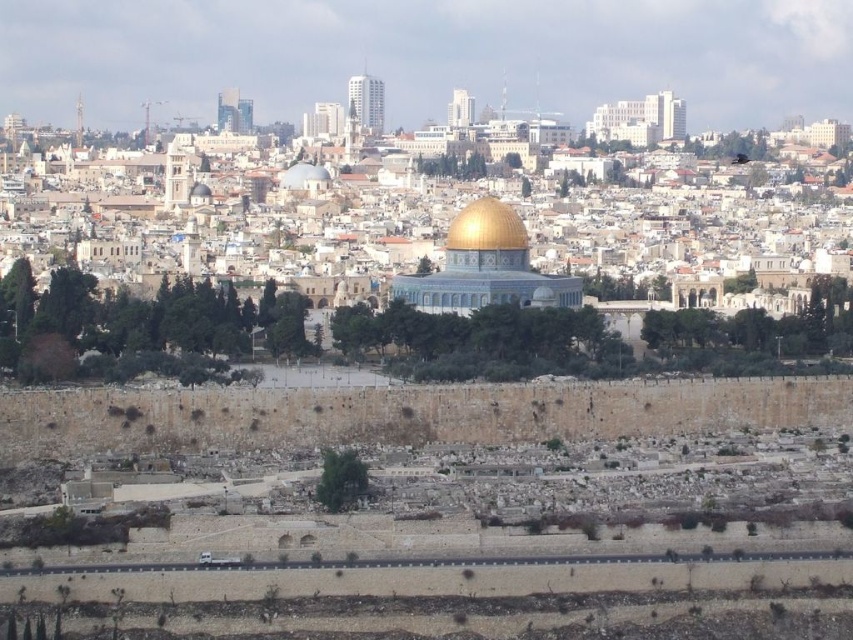
Measure the distance from gold shiny dome at center to white marble dome at center.

gold shiny dome at center is 155.10 feet from white marble dome at center.

Looking at this image, can you confirm if gold shiny dome at center is shorter than white marble dome at center?

No, gold shiny dome at center is not shorter than white marble dome at center.

The width and height of the screenshot is (853, 640). What do you see at coordinates (486, 227) in the screenshot?
I see `gold shiny dome at center` at bounding box center [486, 227].

The image size is (853, 640). I want to click on gold shiny dome at center, so click(x=486, y=227).